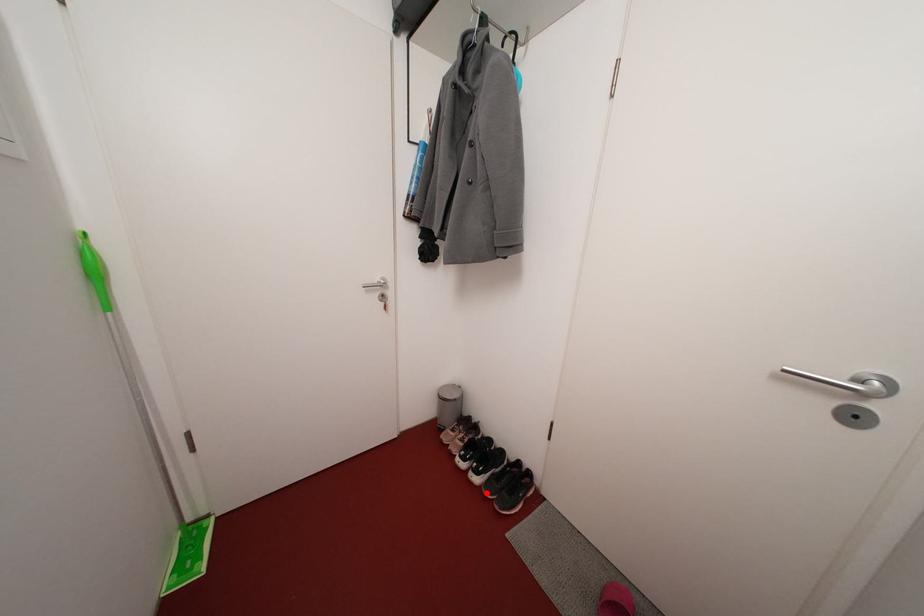
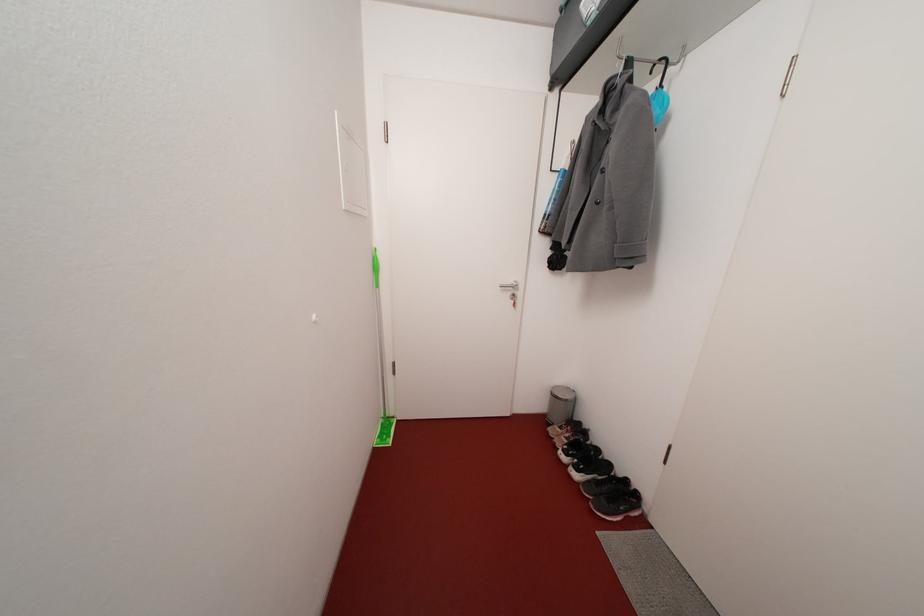
Find the pixel in the second image that matches the highlighted location in the first image.

(585, 488)